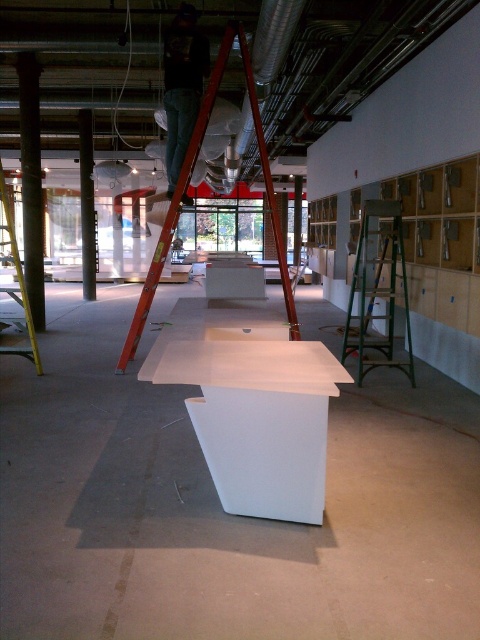
Is point (175, 124) behind point (79, 156)?

That is False.

Which is more to the left, dark denim jeans at upper center or smooth concrete pillar at left?

Positioned to the left is smooth concrete pillar at left.

Does point (189, 112) come closer to viewer compared to point (92, 289)?

Yes, point (189, 112) is in front of point (92, 289).

Where is `dark denim jeans at upper center`? The height and width of the screenshot is (640, 480). dark denim jeans at upper center is located at coordinates (181, 86).

Can you confirm if metallic red ladder at upper center is smaller than smooth concrete pillar at left?

Actually, metallic red ladder at upper center might be larger than smooth concrete pillar at left.

This screenshot has width=480, height=640. What are the coordinates of `metallic red ladder at upper center` in the screenshot? It's located at (187, 188).

Which of these two, metallic red ladder at upper center or smooth concrete column at left, stands shorter?

Standing shorter between the two is metallic red ladder at upper center.

Who is lower down, metallic red ladder at upper center or smooth concrete column at left?

metallic red ladder at upper center

Which is behind, point (284, 282) or point (35, 196)?

Positioned behind is point (35, 196).

The height and width of the screenshot is (640, 480). Identify the location of metallic red ladder at upper center. (187, 188).